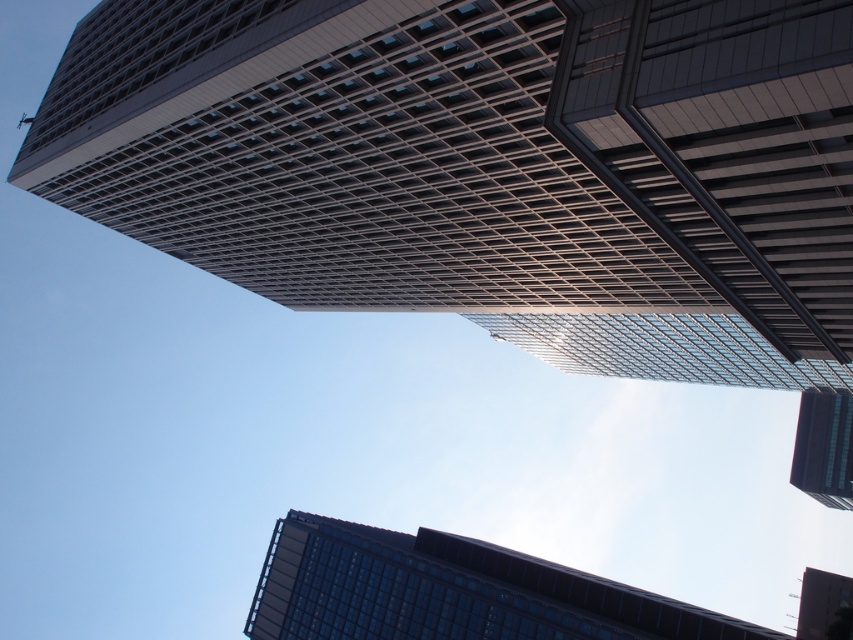
You are standing on the ground floor of the building complex and looking up at the two towers. Which one of the metallic glass skyscraper at upper center and the glassy reflective tower at upper center is positioned to the left?

The metallic glass skyscraper at upper center is positioned to the left of the glassy reflective tower at upper center.

You are standing on the ground floor of a building and looking up at the point marked as point (827, 412). If you want to reach that point by climbing a ladder, how high should the ladder be?

The point (827, 412) is 450.70 feet away from the viewer, so the ladder should be at least 450.70 feet tall to reach it.

You are an architect designing a new building that needs to fit between the dark glass skyscraper at lower center and the glassy reflective tower at upper center. Based on their widths, which building should your new structure align with to ensure it doesn t protrude too far into the street below?

The dark glass skyscraper at lower center is wider than the glassy reflective tower at upper center. Therefore, aligning the new structure with the dark glass skyscraper at lower center will ensure it doesn t protrude too far into the street below since it has a greater width to accommodate the design.